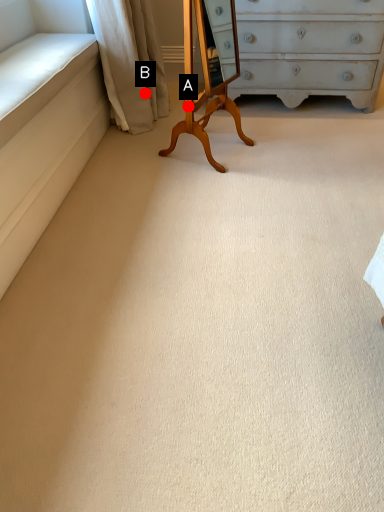
Question: Two points are circled on the image, labeled by A and B beside each circle. Which of the following is the closest to the observer?

Choices:
 (A) A is closer
 (B) B is closer

Answer: (A)